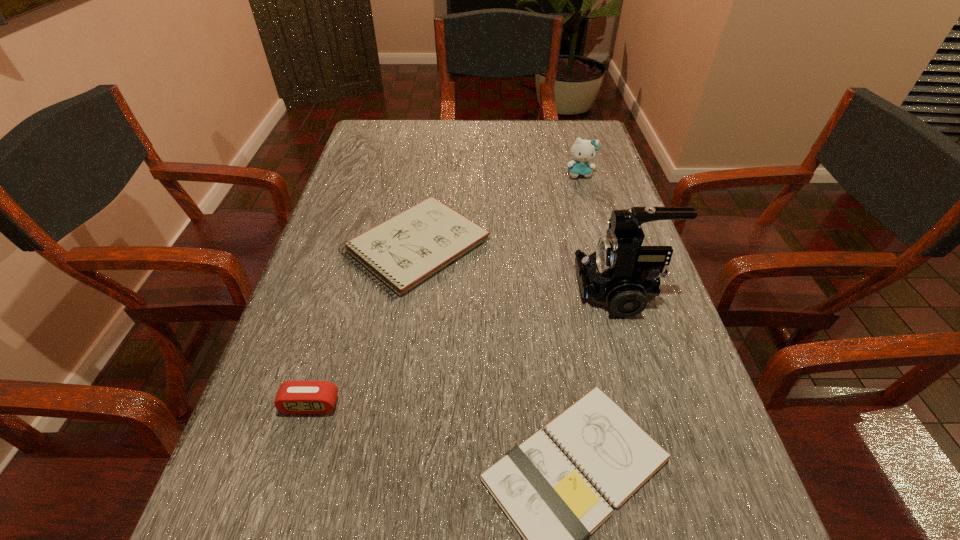
You are a GUI agent. You are given a task and a screenshot of the screen. Output one action in this format:
    pyautogui.click(x=<x>, y=<y>)
    Task: Click on the camcorder
    
    Given the screenshot: What is the action you would take?
    pyautogui.click(x=621, y=274)

This screenshot has width=960, height=540. I want to click on the second tallest object, so click(583, 151).

Locate an element on the screen. kitten is located at coordinates (583, 151).

Where is `the third tallest object`? the third tallest object is located at coordinates (294, 397).

This screenshot has height=540, width=960. I want to click on the fourth tallest object, so click(403, 251).

You are a GUI agent. You are given a task and a screenshot of the screen. Output one action in this format:
    pyautogui.click(x=<x>, y=<y>)
    Task: Click on the farther notepad
    
    Given the screenshot: What is the action you would take?
    pyautogui.click(x=403, y=251)

The height and width of the screenshot is (540, 960). In order to click on free point located 0.370m on the lens mount of the camcorder in this screenshot , I will do `click(399, 291)`.

This screenshot has height=540, width=960. I want to click on blank space located 0.390m on the lens mount of the camcorder, so click(x=390, y=291).

Find the location of a particular element. The image size is (960, 540). vacant space situated on the lens mount of the camcorder is located at coordinates (548, 291).

Locate an element on the screen. vacant position located 0.150m on the face of the second tallest object is located at coordinates (591, 213).